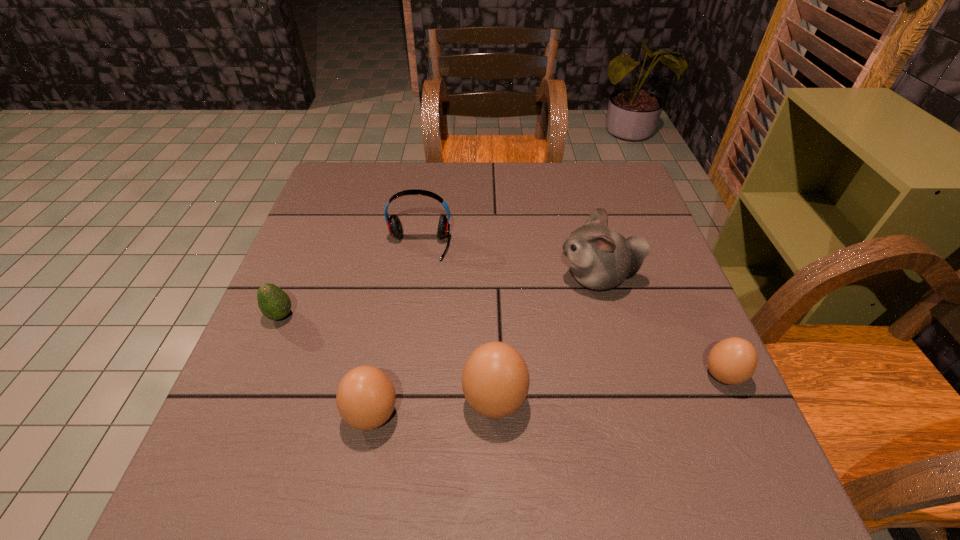
Where is `vacant space located on the left of the fourth object from left to right`? The image size is (960, 540). vacant space located on the left of the fourth object from left to right is located at coordinates (240, 401).

This screenshot has height=540, width=960. In order to click on free spot located on the back of the rightmost object in this screenshot , I will do `click(657, 229)`.

You are a GUI agent. You are given a task and a screenshot of the screen. Output one action in this format:
    pyautogui.click(x=<x>, y=<y>)
    Task: Click on the free space located 0.230m on the face of the second object from right to left
    This screenshot has height=540, width=960.
    Given the screenshot: What is the action you would take?
    pyautogui.click(x=458, y=278)

The height and width of the screenshot is (540, 960). Identify the location of vacant area located on the face of the second object from right to left. (401, 278).

Locate an element on the screen. Image resolution: width=960 pixels, height=540 pixels. vacant space located 0.220m on the face of the second object from right to left is located at coordinates (462, 278).

What are the coordinates of `free space located 0.360m on the back of the avocado` in the screenshot? It's located at (326, 206).

Where is `free spot located 0.300m with the microphone attached to the side of the headset`? The image size is (960, 540). free spot located 0.300m with the microphone attached to the side of the headset is located at coordinates (400, 369).

At what (x,y) coordinates should I click in order to perform the action: click on object present at the left edge. Please return your answer as a coordinate pair (x, y). Looking at the image, I should click on (274, 303).

The height and width of the screenshot is (540, 960). In order to click on boiled egg that is positioned at the right edge in this screenshot , I will do `click(732, 361)`.

This screenshot has width=960, height=540. I want to click on hamster that is positioned at the right edge, so click(x=600, y=258).